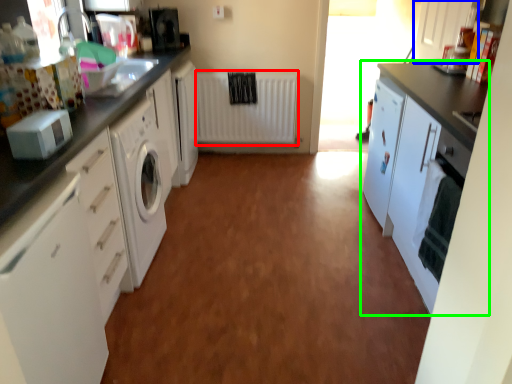
Question: Based on their relative distances, which object is nearer to radiator (highlighted by a red box)? Choose from cabinetry (highlighted by a blue box) and cabinetry (highlighted by a green box).

Choices:
 (A) cabinetry
 (B) cabinetry

Answer: (A)